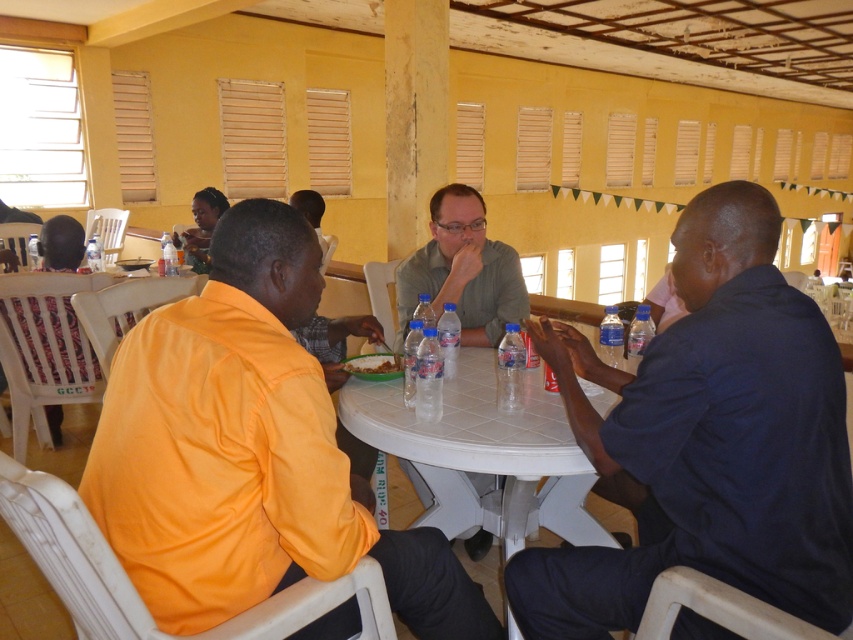
You are a photographer standing at the camera position. You want to take a closeup photo of the dark blue shirt at right. Can you estimate how far you need to move forward to get a closeup shot?

The dark blue shirt at right is 1.19 meters away from the camera. To take a closeup photo, you would need to move closer to reduce the distance between the camera and the subject.

You are a photographer trying to capture a group photo of the people at the table. Since you want everyone to be visible, you need to adjust the camera angle. Considering the height difference between the dark blue shirt at right and the orange fabric shirt at center, which person should you ask to sit slightly higher to ensure both are visible in the photo?

The dark blue shirt at right has a lesser height compared to orange fabric shirt at center. To ensure both are visible, you should ask the dark blue shirt at right to sit slightly higher so their head reaches the same level as the orange fabric shirt at center.